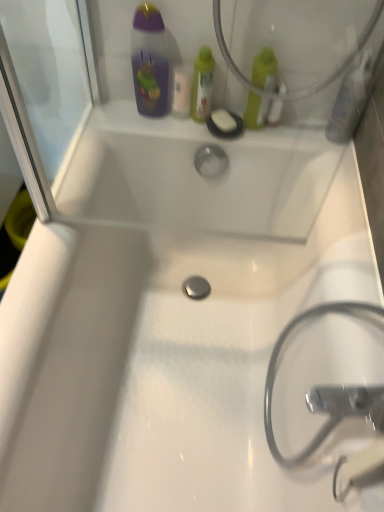
Identify the location of vacant area located to the right-hand side of green matte bottle at upper right, placed as the 3th mouthwash when sorted from left to right. (309, 136).